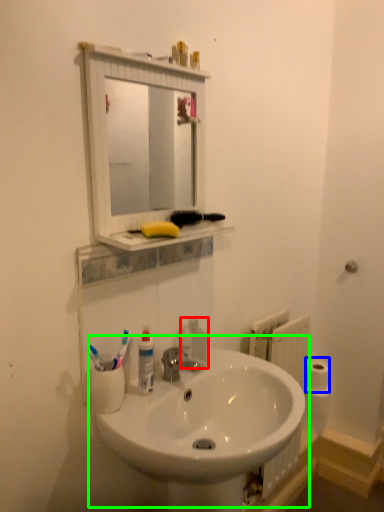
Question: Which is nearer to the soap dispenser (highlighted by a red box)? toilet paper (highlighted by a blue box) or sink (highlighted by a green box).

Choices:
 (A) toilet paper
 (B) sink

Answer: (B)